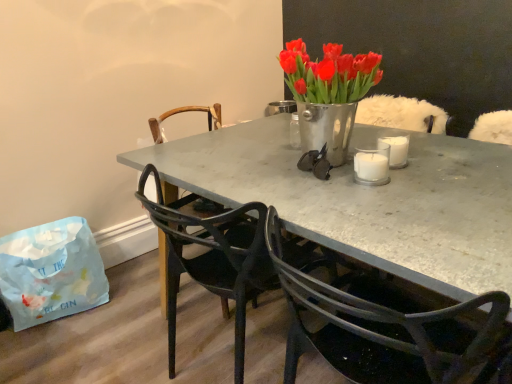
Image resolution: width=512 pixels, height=384 pixels. What are the coordinates of `vacant space in between matte black chair at center, the second chair from the back, and white paper bag at lower left` in the screenshot? It's located at (129, 306).